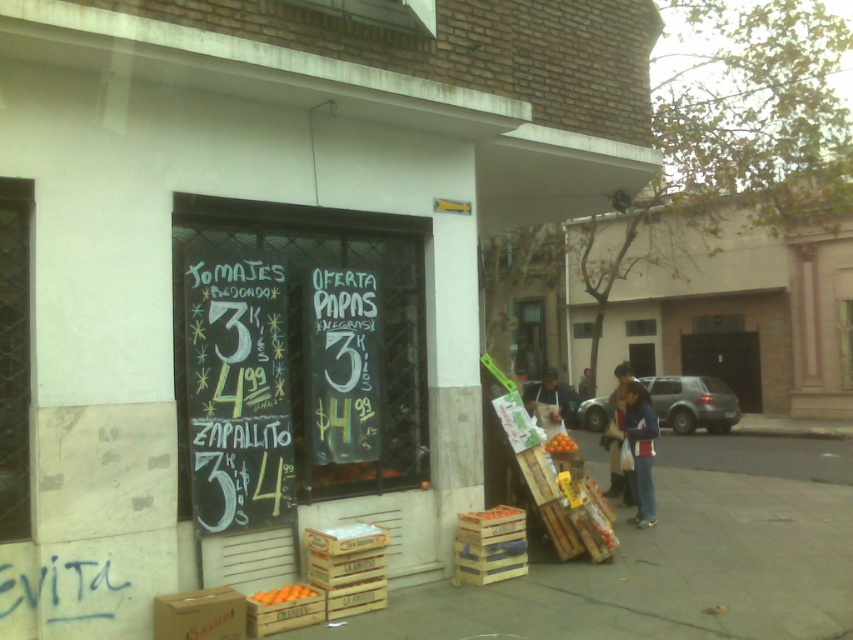
Is point (795, 502) farther from viewer compared to point (273, 600)?

Yes, point (795, 502) is behind point (273, 600).

Can you confirm if wooden crates at lower center is positioned to the left of orangewooden crate at lower center?

No, wooden crates at lower center is not to the left of orangewooden crate at lower center.

Is point (671, 634) positioned before point (285, 600)?

Yes, point (671, 634) is closer to viewer.

This screenshot has width=853, height=640. I want to click on wooden crates at lower center, so click(x=660, y=573).

Which of these two, blue denim jeans at lower right or white fabric bag at center, stands taller?

white fabric bag at center

Between point (646, 440) and point (548, 420), which one is positioned in front?

Point (646, 440) is more forward.

Where is `blue denim jeans at lower right`? blue denim jeans at lower right is located at coordinates (640, 449).

Which is below, blue denim jeans at lower right or orangewooden crate at lower center?

orangewooden crate at lower center is lower down.

Is point (631, 433) positioned behind point (305, 589)?

Yes, point (631, 433) is farther from viewer.

Where is `blue denim jeans at lower right`? blue denim jeans at lower right is located at coordinates (640, 449).

The height and width of the screenshot is (640, 853). What are the coordinates of `blue denim jeans at lower right` in the screenshot? It's located at (640, 449).